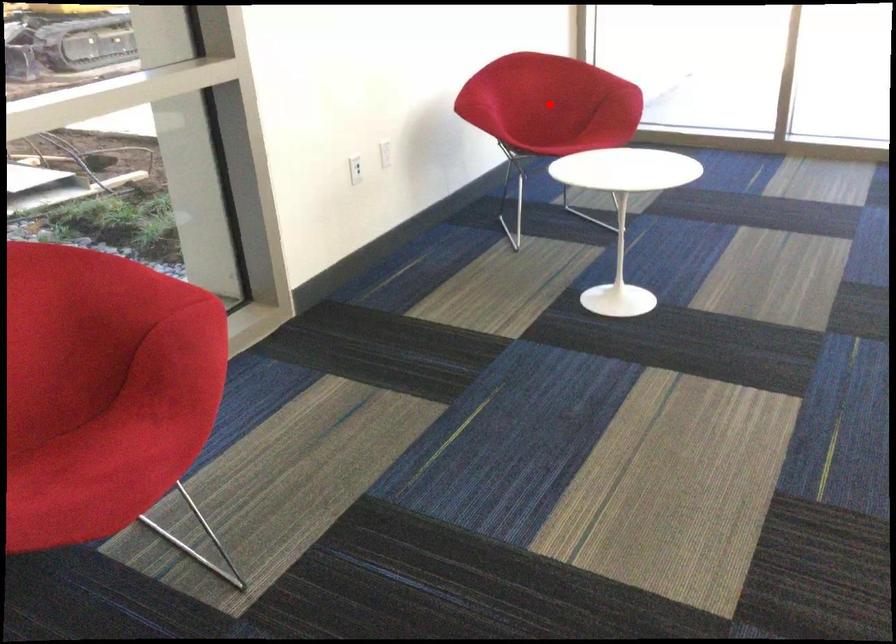
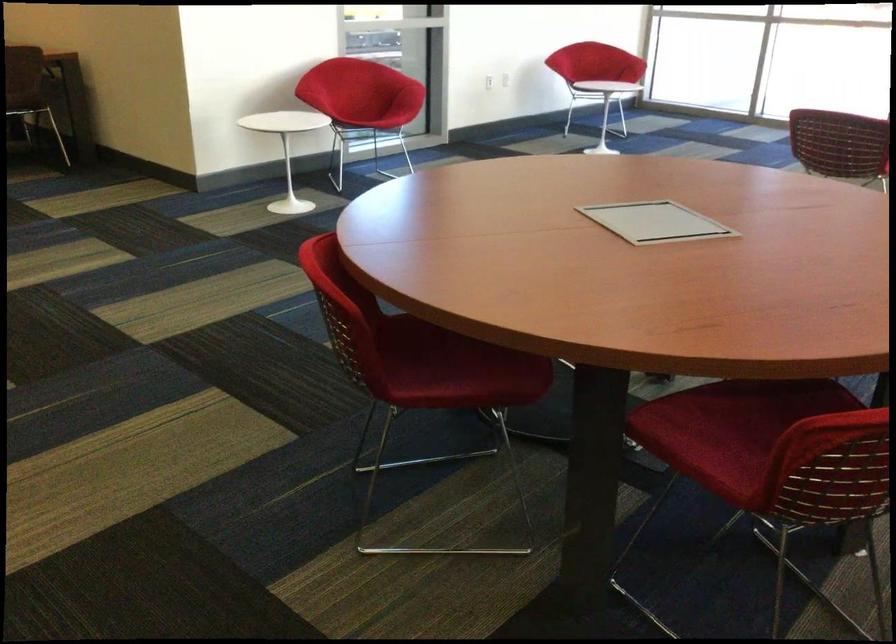
Question: I am providing you with two images of the same scene from different viewpoints. A red point is marked on the first image. At the location where the point appears in image 1, is it still visible in image 2?

Choices:
 (A) Yes
 (B) No

Answer: (B)